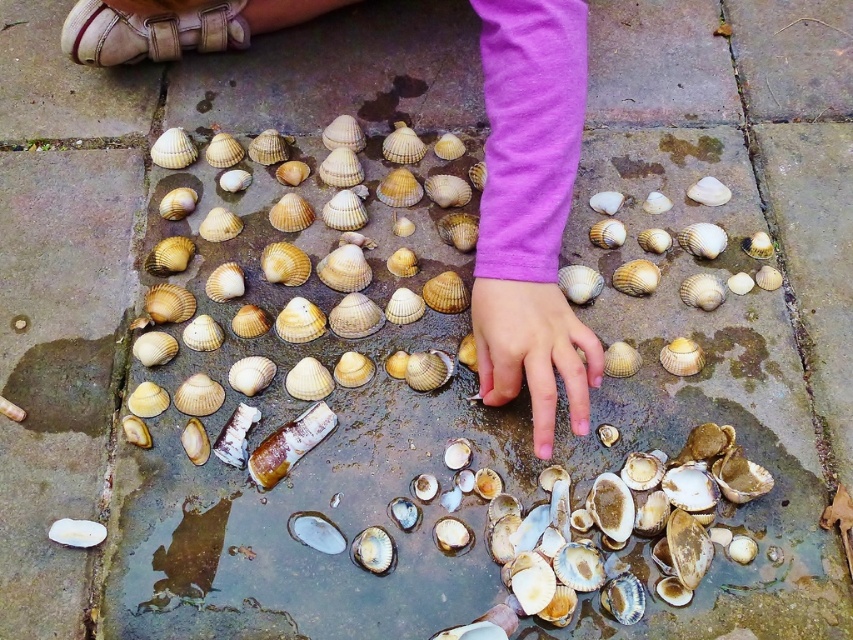
Is smooth beige shell at center bigger than white matte shell at center?

Indeed, smooth beige shell at center has a larger size compared to white matte shell at center.

Is smooth beige shell at center wider than white matte shell at center?

Incorrect, smooth beige shell at center's width does not surpass white matte shell at center's.

Who is more forward, (682, 353) or (74, 531)?

Point (74, 531) is more forward.

This screenshot has width=853, height=640. Identify the location of smooth beige shell at center. (682, 356).

Between point (550, 371) and point (103, 531), which one is positioned in front?

Point (550, 371) is in front.

Looking at this image, can you confirm if smooth skin hand at center is positioned below white matte shell at center?

No, smooth skin hand at center is not below white matte shell at center.

Between point (521, 321) and point (84, 524), which one is positioned in front?

Point (521, 321) is more forward.

You are a GUI agent. You are given a task and a screenshot of the screen. Output one action in this format:
    pyautogui.click(x=<x>, y=<y>)
    Task: Click on the smooth skin hand at center
    
    Given the screenshot: What is the action you would take?
    pyautogui.click(x=532, y=353)

Can you confirm if smooth skin hand at center is bigger than smooth beige shell at center?

Yes, smooth skin hand at center is bigger than smooth beige shell at center.

In the scene shown: Can you confirm if smooth skin hand at center is wider than smooth beige shell at center?

Yes.

Where is `smooth skin hand at center`? Image resolution: width=853 pixels, height=640 pixels. smooth skin hand at center is located at coordinates tap(532, 353).